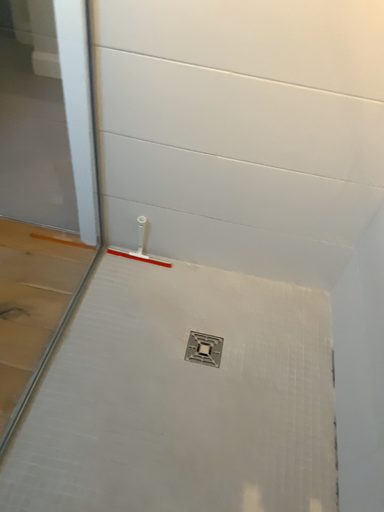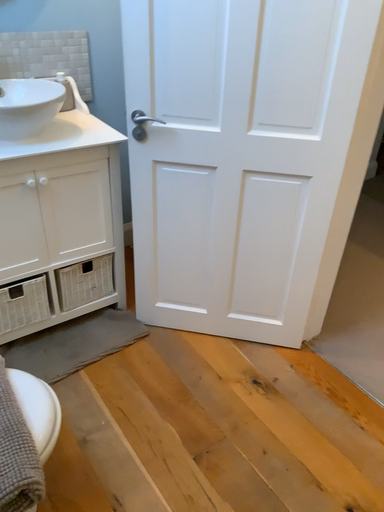
Question: Which way did the camera rotate in the video?

Choices:
 (A) rotated downward
 (B) rotated upward

Answer: (B)